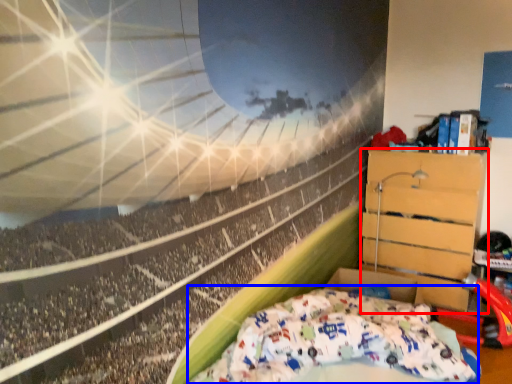
Question: Which object appears farthest to the camera in this image, furniture (highlighted by a red box) or bed (highlighted by a blue box)?

Choices:
 (A) furniture
 (B) bed

Answer: (A)